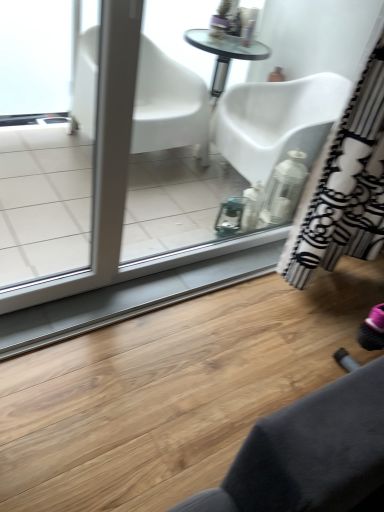
Question: In terms of width, does black and white striped curtain at right look wider or thinner when compared to white glossy screen door at left?

Choices:
 (A) wide
 (B) thin

Answer: (A)

Question: Do you think black and white striped curtain at right is within white glossy screen door at left, or outside of it?

Choices:
 (A) outside
 (B) inside

Answer: (A)

Question: From a real-world perspective, is black and white striped curtain at right physically located above or below white glossy screen door at left?

Choices:
 (A) below
 (B) above

Answer: (B)

Question: In the image, is white glossy screen door at left positioned in front of or behind black and white striped curtain at right?

Choices:
 (A) behind
 (B) front

Answer: (B)

Question: From a real-world perspective, relative to black and white striped curtain at right, is white glossy screen door at left vertically above or below?

Choices:
 (A) above
 (B) below

Answer: (B)

Question: Is white glossy screen door at left inside the boundaries of black and white striped curtain at right, or outside?

Choices:
 (A) outside
 (B) inside

Answer: (A)

Question: Considering the relative positions of white glossy screen door at left and black and white striped curtain at right in the image provided, is white glossy screen door at left to the left or to the right of black and white striped curtain at right?

Choices:
 (A) left
 (B) right

Answer: (A)